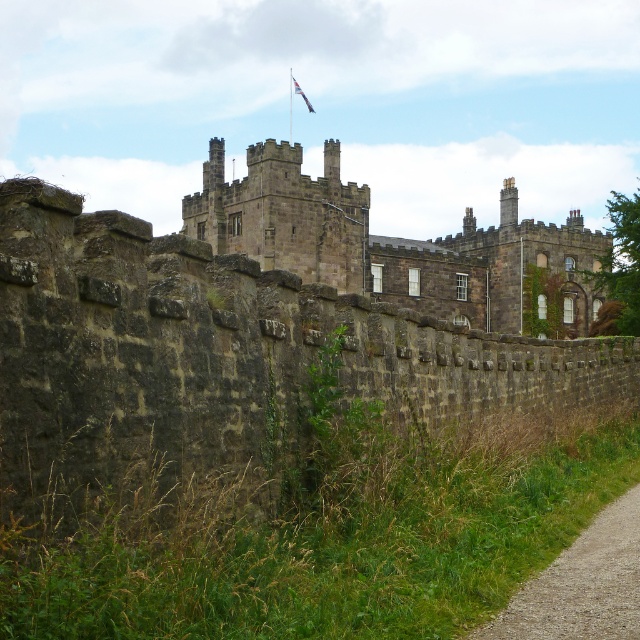
Question: Which object appears farthest from the camera in this image?

Choices:
 (A) dark stone castle at center
 (B) gravel path at lower right
 (C) blue fabric flag at upper center

Answer: (C)

Question: Can you confirm if gravel path at lower right is positioned to the right of blue fabric flag at upper center?

Choices:
 (A) no
 (B) yes

Answer: (B)

Question: Which of the following is the closest to the observer?

Choices:
 (A) dark stone castle at center
 (B) blue fabric flag at upper center
 (C) gravel path at lower right

Answer: (C)

Question: Does dark stone castle at center have a greater width compared to gravel path at lower right?

Choices:
 (A) yes
 (B) no

Answer: (A)

Question: Which object is the closest to the gravel path at lower right?

Choices:
 (A) blue fabric flag at upper center
 (B) dark stone castle at center

Answer: (B)

Question: Can you confirm if gravel path at lower right is smaller than blue fabric flag at upper center?

Choices:
 (A) yes
 (B) no

Answer: (A)